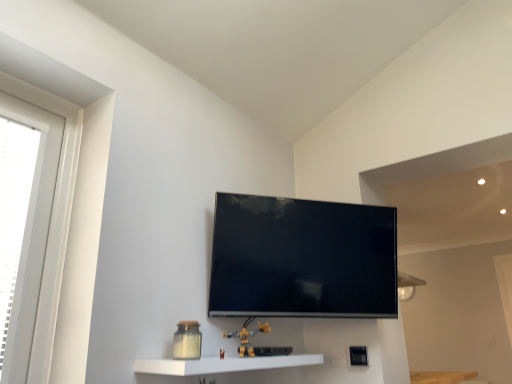
Question: Is yellow plastic toy at lower center directly adjacent to white plastic window at left?

Choices:
 (A) no
 (B) yes

Answer: (A)

Question: Considering the relative sizes of yellow plastic toy at lower center and white plastic window at left in the image provided, is yellow plastic toy at lower center wider than white plastic window at left?

Choices:
 (A) yes
 (B) no

Answer: (A)

Question: From the image's perspective, is yellow plastic toy at lower center located above white plastic window at left?

Choices:
 (A) yes
 (B) no

Answer: (B)

Question: Is yellow plastic toy at lower center shorter than white plastic window at left?

Choices:
 (A) yes
 (B) no

Answer: (A)

Question: Is yellow plastic toy at lower center positioned with its back to white plastic window at left?

Choices:
 (A) yes
 (B) no

Answer: (B)

Question: From the image's perspective, does yellow plastic toy at lower center appear lower than white plastic window at left?

Choices:
 (A) yes
 (B) no

Answer: (A)

Question: Considering the relative positions of flat screen tv at center and white plastic window at left in the image provided, is flat screen tv at center behind white plastic window at left?

Choices:
 (A) yes
 (B) no

Answer: (A)

Question: Is flat screen tv at center surrounding white plastic window at left?

Choices:
 (A) no
 (B) yes

Answer: (A)

Question: Can you confirm if flat screen tv at center is positioned to the right of white plastic window at left?

Choices:
 (A) no
 (B) yes

Answer: (B)

Question: Is flat screen tv at center positioned far away from white plastic window at left?

Choices:
 (A) yes
 (B) no

Answer: (B)

Question: From the image's perspective, is flat screen tv at center on top of white plastic window at left?

Choices:
 (A) no
 (B) yes

Answer: (A)

Question: Can you confirm if flat screen tv at center is thinner than white plastic window at left?

Choices:
 (A) yes
 (B) no

Answer: (B)

Question: From a real-world perspective, is yellow plastic toy at lower center positioned over flat screen tv at center based on gravity?

Choices:
 (A) no
 (B) yes

Answer: (A)